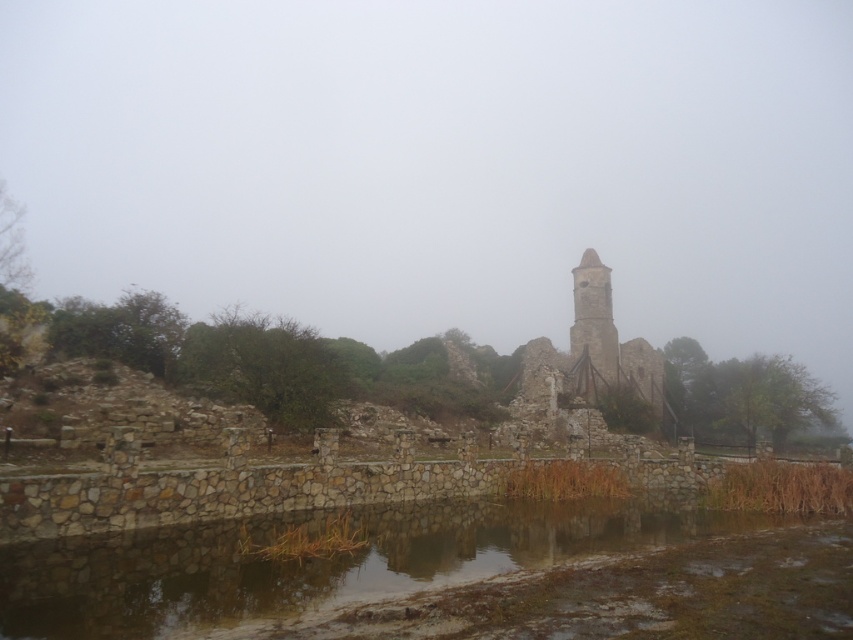
Between point (776, 579) and point (585, 401), which one is positioned in front?

Point (776, 579)

Locate an element on the screen. smooth stone river at center is located at coordinates (450, 579).

Does smooth stone river at center lie in front of rustic stone bell tower at center?

Yes, it is.

Does smooth stone river at center have a lesser height compared to rustic stone bell tower at center?

Yes.

Is point (575, 524) less distant than point (595, 353)?

Yes, point (575, 524) is in front of point (595, 353).

Find the location of a particular element. smooth stone river at center is located at coordinates (450, 579).

Can you confirm if rustic stone tower at center is positioned to the left of rustic stone bell tower at center?

No, rustic stone tower at center is not to the left of rustic stone bell tower at center.

Is rustic stone tower at center bigger than rustic stone bell tower at center?

Yes.

Is point (601, 292) farther from camera compared to point (585, 326)?

Yes, point (601, 292) is behind point (585, 326).

Where is `rustic stone tower at center`? Image resolution: width=853 pixels, height=640 pixels. rustic stone tower at center is located at coordinates (592, 368).